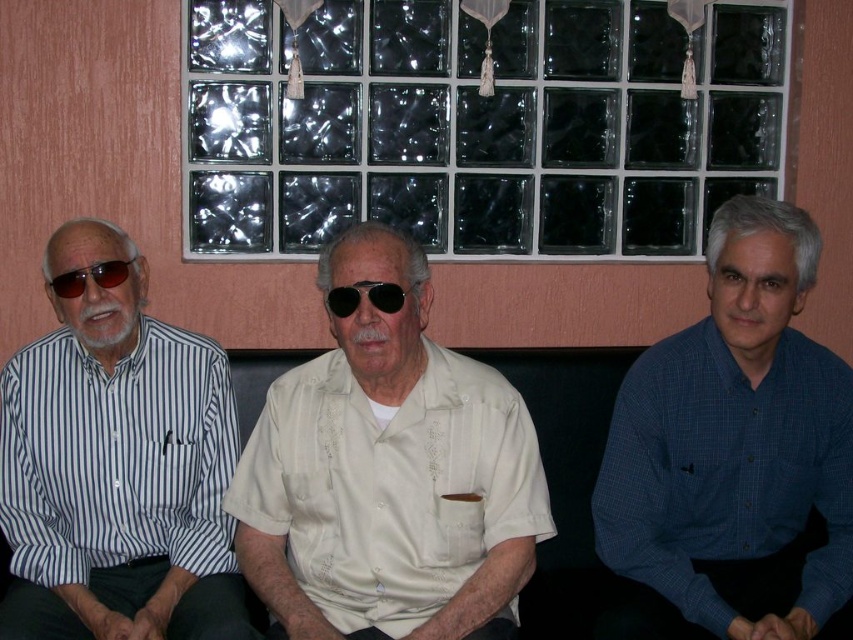
You are a photographer setting up a portrait session in this scene. You need to ensure that the matte beige shirt at center and the matte black sunglasses at left are both clearly visible in the frame. Considering their sizes, which object should you focus on first to ensure proper exposure?

The matte beige shirt at center has a greater height compared to the matte black sunglasses at left, so you should focus on the matte beige shirt at center first since it is larger and will require more precise exposure adjustments.

You are a photographer trying to capture a candid shot of the matte beige shirt at center and the matte black sunglasses at left. Since you want to ensure both are in focus, you need to know their vertical positions. Which one is positioned lower in the image?

The matte beige shirt at center is located below matte black sunglasses at left, so the matte beige shirt at center is positioned lower in the image.

You are a tailor measuring shirts for alterations. You have a table that can only accommodate the wider of the two shirts. Which shirt should you place on the table first, the matte beige shirt at center or the blue checkered shirt at right?

The matte beige shirt at center is wider than the blue checkered shirt at right, so you should place the matte beige shirt at center on the table first.